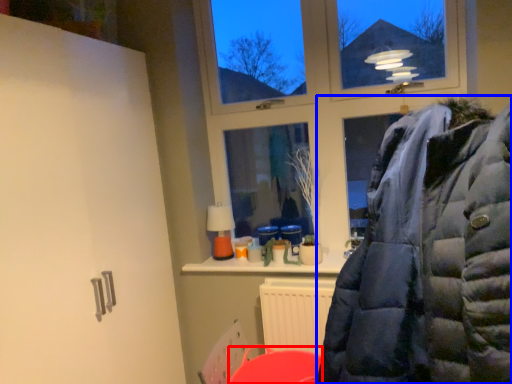
Question: Which object is closer to the camera taking this photo, table (highlighted by a red box) or jacket (highlighted by a blue box)?

Choices:
 (A) table
 (B) jacket

Answer: (B)